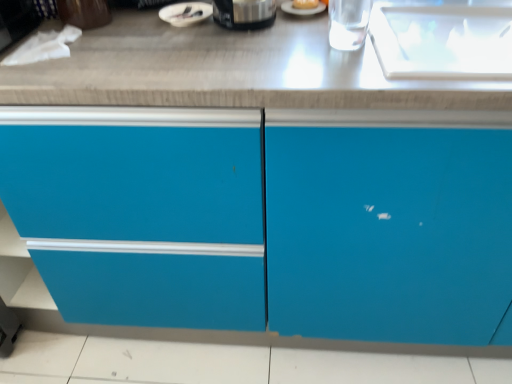
Question: Does white glossy bowl at upper center, placed as the 2th appliance when sorted from right to left, have a lesser height compared to matte blue cabinet at center?

Choices:
 (A) no
 (B) yes

Answer: (B)

Question: From a real-world perspective, does white glossy bowl at upper center, marked as the 1th appliance in a left-to-right arrangement, stand above matte blue cabinet at center?

Choices:
 (A) yes
 (B) no

Answer: (A)

Question: Is white glossy bowl at upper center, marked as the 1th appliance in a left-to-right arrangement, to the right of matte blue cabinet at center from the viewer's perspective?

Choices:
 (A) no
 (B) yes

Answer: (A)

Question: Is white glossy bowl at upper center, marked as the 1th appliance in a left-to-right arrangement, beside matte blue cabinet at center?

Choices:
 (A) no
 (B) yes

Answer: (A)

Question: Is the position of white glossy bowl at upper center, marked as the 1th appliance in a left-to-right arrangement, more distant than that of matte blue cabinet at center?

Choices:
 (A) yes
 (B) no

Answer: (A)

Question: Is there a large distance between white glossy bowl at upper center, placed as the 2th appliance when sorted from right to left, and matte blue cabinet at center?

Choices:
 (A) yes
 (B) no

Answer: (B)

Question: From the image's perspective, is white glossy bowl at upper center, marked as the 1th appliance in a left-to-right arrangement, over golden bread at center?

Choices:
 (A) yes
 (B) no

Answer: (B)

Question: Is white glossy bowl at upper center, placed as the 2th appliance when sorted from right to left, facing towards golden bread at center?

Choices:
 (A) no
 (B) yes

Answer: (A)

Question: From the image's perspective, would you say white glossy bowl at upper center, marked as the 1th appliance in a left-to-right arrangement, is shown under golden bread at center?

Choices:
 (A) no
 (B) yes

Answer: (B)

Question: Is white glossy bowl at upper center, marked as the 1th appliance in a left-to-right arrangement, smaller than golden bread at center?

Choices:
 (A) no
 (B) yes

Answer: (A)

Question: Considering the relative sizes of white glossy bowl at upper center, placed as the 2th appliance when sorted from right to left, and golden bread at center in the image provided, is white glossy bowl at upper center, placed as the 2th appliance when sorted from right to left, bigger than golden bread at center?

Choices:
 (A) yes
 (B) no

Answer: (A)

Question: From a real-world perspective, is white glossy bowl at upper center, marked as the 1th appliance in a left-to-right arrangement, below golden bread at center?

Choices:
 (A) yes
 (B) no

Answer: (A)

Question: Does matte blue cabinet at center turn towards white glossy bowl at upper center, marked as the 1th appliance in a left-to-right arrangement?

Choices:
 (A) yes
 (B) no

Answer: (B)